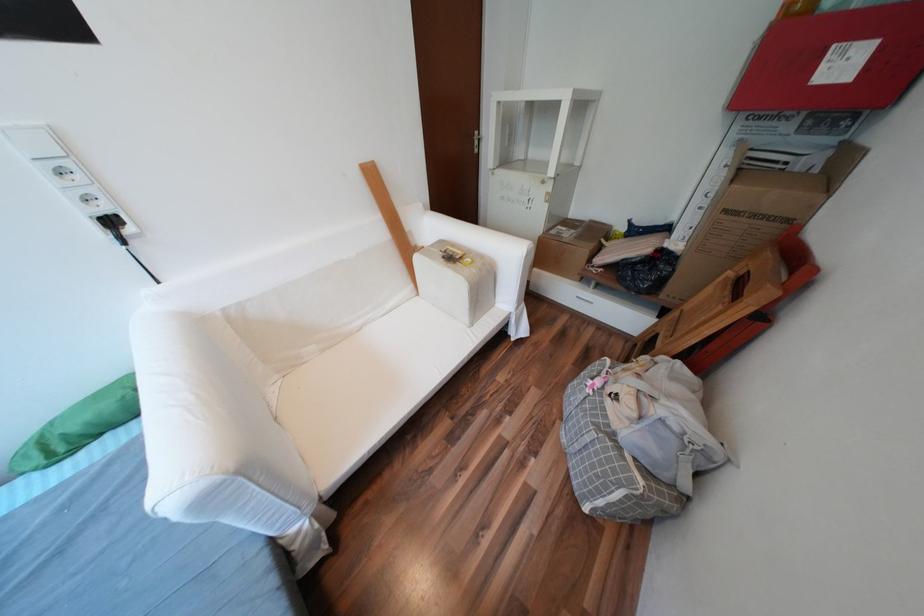
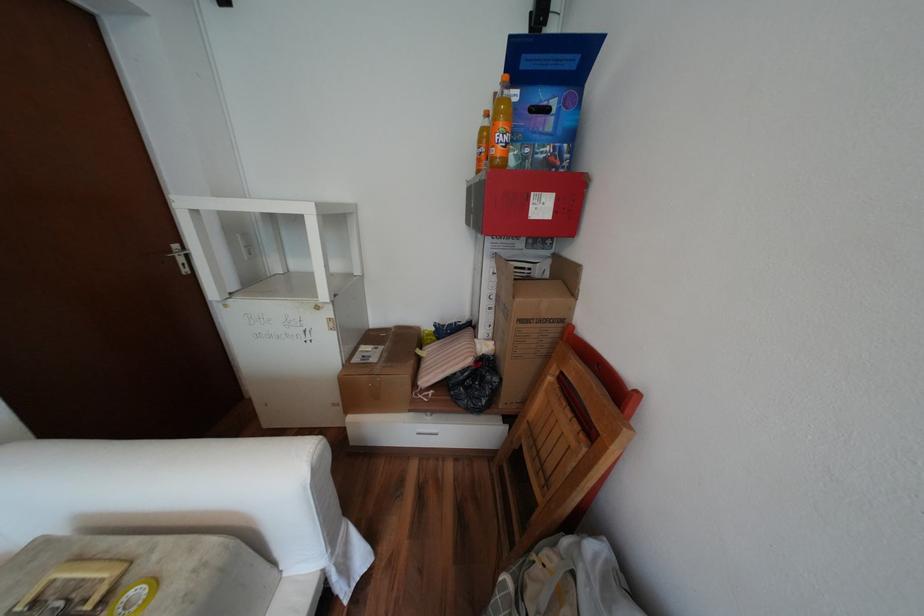
Question: The camera is either moving clockwise (left) or counter-clockwise (right) around the object. The first image is from the beginning of the video and the second image is from the end. Is the camera moving left or right when shooting the video?

Choices:
 (A) Left
 (B) Right

Answer: (A)